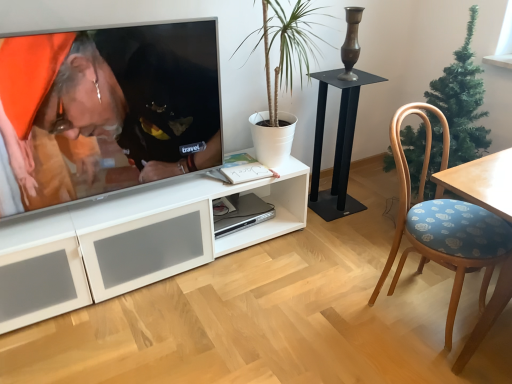
Find the location of a particular element. vacant area that lies between black metal table at center and green artificial christmas tree at right is located at coordinates (367, 215).